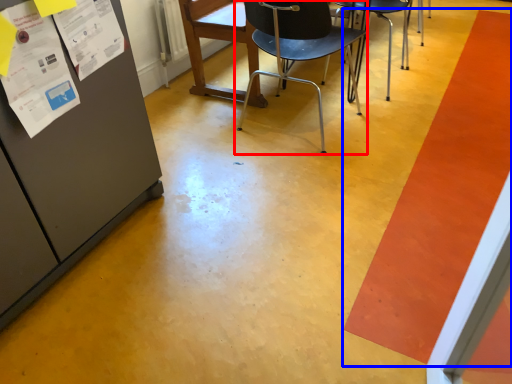
Question: Which point is further to the camera, chair (highlighted by a red box) or strip (highlighted by a blue box)?

Choices:
 (A) chair
 (B) strip

Answer: (A)